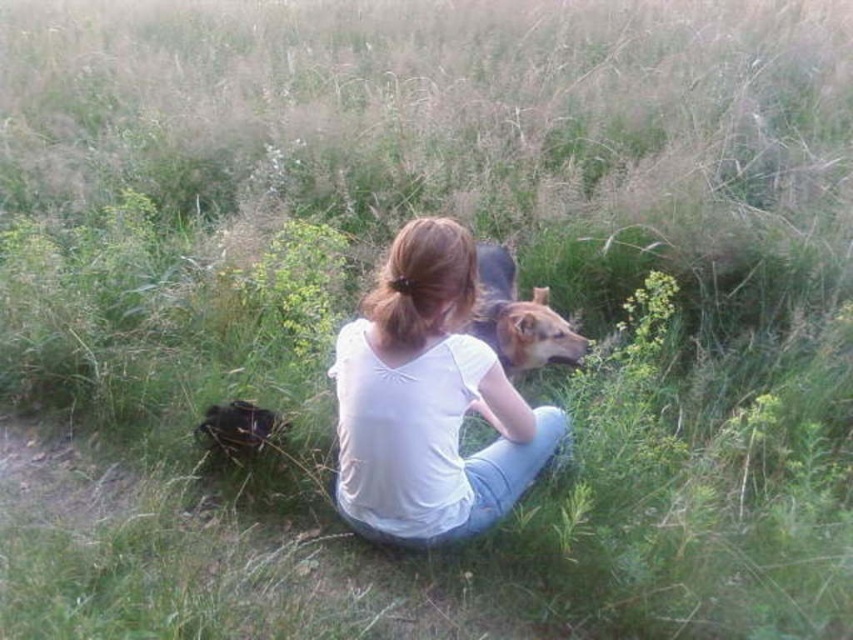
You are a photographer trying to capture a closeup of the woman and her dog. You have two focus points available at coordinates point (364, 488) and point (515, 355). Which focus point should you choose to ensure the woman and her dog are in focus?

You should choose point (364, 488) because it is closer to the camera than point (515, 355), ensuring the woman and her dog are in focus.

You are standing in the outdoor scene described. You need to locate the white cotton shirt at center. Where exactly would you look to find it?

The white cotton shirt at center is located at point coordinates of (428, 401).

You are a photographer standing in the scene and want to take a picture of the white cotton shirt at center and the brown fur dog at center. Based on their positions, which object is located to the left side in the image?

The white cotton shirt at center is to the left of the brown fur dog at center.